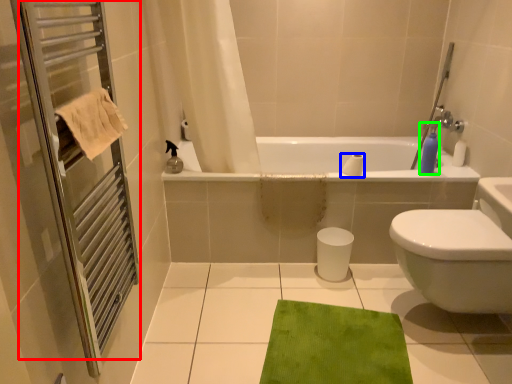
Question: Which is nearer to the screen door (highlighted by a red box)? toilet paper (highlighted by a blue box) or soap dispenser (highlighted by a green box).

Choices:
 (A) toilet paper
 (B) soap dispenser

Answer: (A)